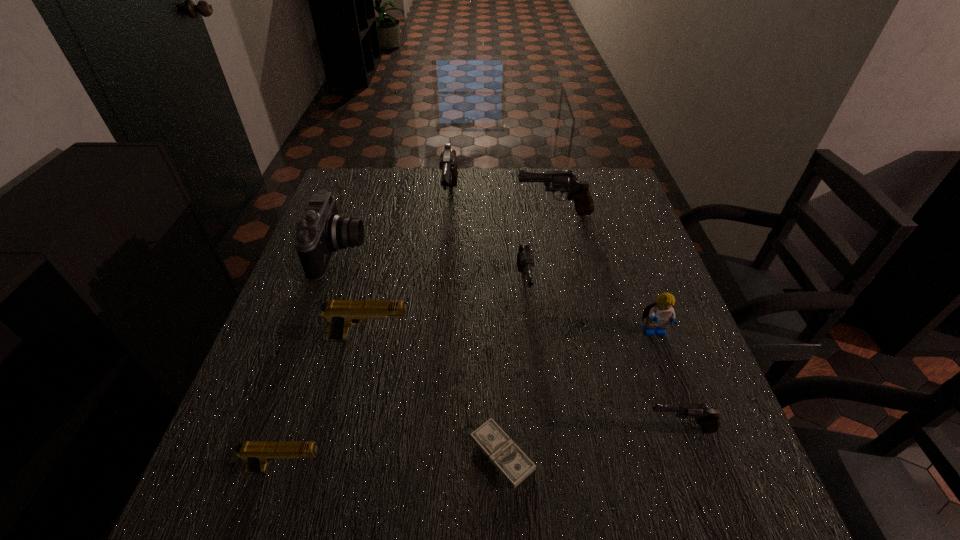
Locate an element on the screen. pistol that stands as the third closest to the smaller tan pistol is located at coordinates (708, 417).

Locate which pistol ranks third in proximity to the third farthest gray pistol. Please provide its 2D coordinates. Your answer should be formatted as a tuple, i.e. [(x, y)], where the tuple contains the x and y coordinates of a point satisfying the conditions above.

[(340, 314)]

At what (x,y) coordinates should I click in order to perform the action: click on gray pistol that is the fourth closest one to the black camera. Please return your answer as a coordinate pair (x, y). This screenshot has width=960, height=540. Looking at the image, I should click on (708, 417).

Identify which gray pistol is the fourth nearest to the nearer tan pistol. Please provide its 2D coordinates. Your answer should be formatted as a tuple, i.e. [(x, y)], where the tuple contains the x and y coordinates of a point satisfying the conditions above.

[(564, 181)]

You are a GUI agent. You are given a task and a screenshot of the screen. Output one action in this format:
    pyautogui.click(x=<x>, y=<y>)
    Task: Click on the free point that satisfies the following two spatial constraints: 1. at the barrel of the third farthest pistol; 2. at the barrel of the bigger tan pistol
    This screenshot has height=540, width=960.
    Given the screenshot: What is the action you would take?
    pyautogui.click(x=530, y=339)

The image size is (960, 540). I want to click on free space that satisfies the following two spatial constraints: 1. at the barrel of the second tallest pistol; 2. at the barrel of the third farthest gray pistol, so click(569, 287).

The width and height of the screenshot is (960, 540). Find the location of `free point that satisfies the following two spatial constraints: 1. at the barrel of the leftmost gray pistol; 2. at the barrel of the smaller tan pistol`. free point that satisfies the following two spatial constraints: 1. at the barrel of the leftmost gray pistol; 2. at the barrel of the smaller tan pistol is located at coordinates (427, 469).

The height and width of the screenshot is (540, 960). Find the location of `blank area in the image that satisfies the following two spatial constraints: 1. at the barrel of the fourth pistol from right to left; 2. at the barrel of the third nearest pistol`. blank area in the image that satisfies the following two spatial constraints: 1. at the barrel of the fourth pistol from right to left; 2. at the barrel of the third nearest pistol is located at coordinates (438, 339).

What are the coordinates of `blank area in the image that satisfies the following two spatial constraints: 1. on the front-facing side of the Lego; 2. at the barrel of the bigger tan pistol` in the screenshot? It's located at (657, 339).